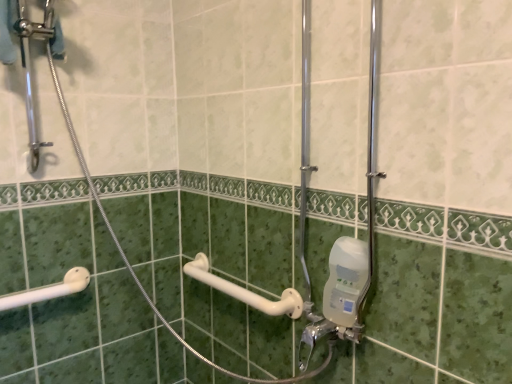
Question: Would you say white plastic grab bar at lower left is inside or outside clear plastic soap dispenser at lower right?

Choices:
 (A) outside
 (B) inside

Answer: (A)

Question: From the image's perspective, is white plastic grab bar at lower left above or below clear plastic soap dispenser at lower right?

Choices:
 (A) above
 (B) below

Answer: (B)

Question: Which is farther from the clear plastic soap dispenser at lower right?

Choices:
 (A) white plastic towel bar at center
 (B) white plastic grab bar at lower left

Answer: (B)

Question: Which of these objects is positioned farthest from the clear plastic soap dispenser at lower right?

Choices:
 (A) white plastic grab bar at lower left
 (B) white plastic towel bar at center

Answer: (A)